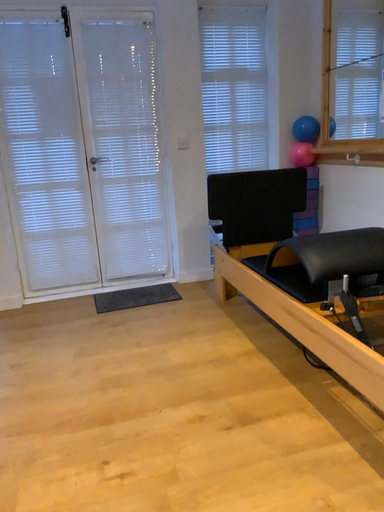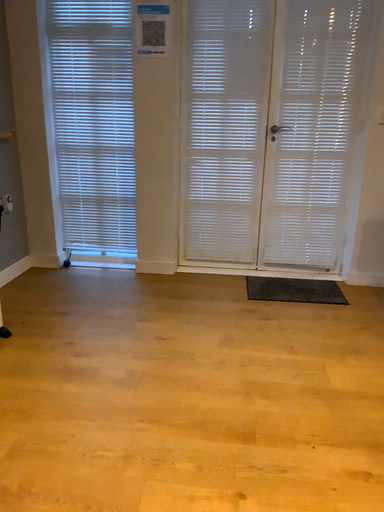
Question: Which way did the camera rotate in the video?

Choices:
 (A) rotated right
 (B) rotated left

Answer: (B)